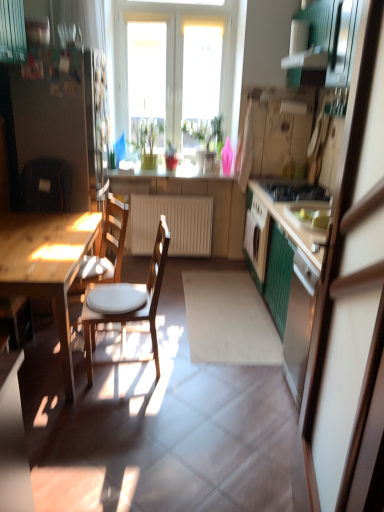
Question: Is point (278, 199) closer or farther from the camera than point (288, 232)?

Choices:
 (A) closer
 (B) farther

Answer: (B)

Question: In terms of height, does black glossy gas stove at center right look taller or shorter compared to green wood cabinet at right?

Choices:
 (A) tall
 (B) short

Answer: (B)

Question: Which object is positioned farthest from the green wood cabinet at right?

Choices:
 (A) wooden table at left
 (B) green matte cabinet at right
 (C) matte white countertop at center
 (D) white glossy exhaust hood at upper center
 (E) wooden chair at center, the 1th chair viewed from the back

Answer: (D)

Question: Which is farther from the green matte plant at center, the second houseplant in the left-to-right sequence?

Choices:
 (A) white matte radiator at center
 (B) wooden chair with white cushion at left, placed as the 2th chair when sorted from back to front
 (C) wooden chair at center, the second chair viewed from the front
 (D) white glossy exhaust hood at upper center
 (E) green wood cabinet at right

Answer: (B)